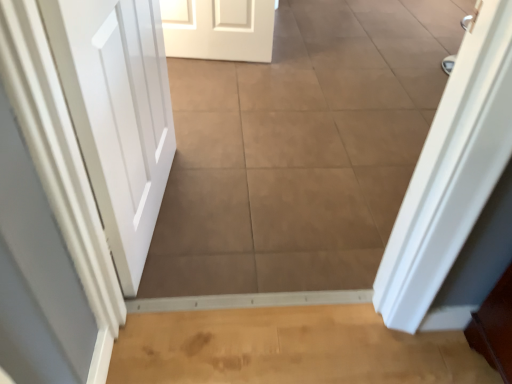
In order to face brown tile floor at center, should I rotate leftwards or rightwards?

Turn right by 14.420 degrees to look at brown tile floor at center.

This screenshot has width=512, height=384. What do you see at coordinates (300, 150) in the screenshot? I see `brown tile floor at center` at bounding box center [300, 150].

Where is `brown tile floor at center`? The width and height of the screenshot is (512, 384). brown tile floor at center is located at coordinates (300, 150).

I want to click on brown tile floor at center, so click(300, 150).